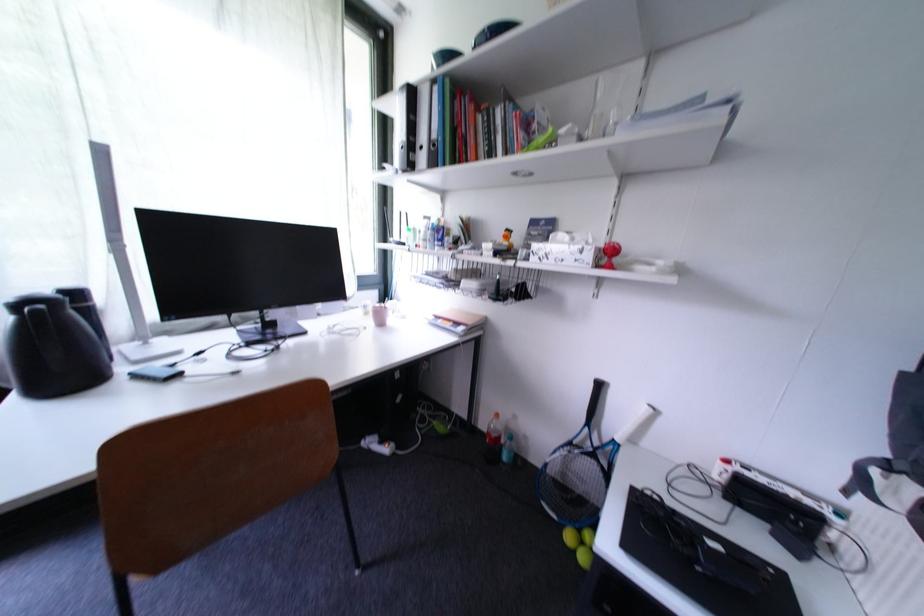
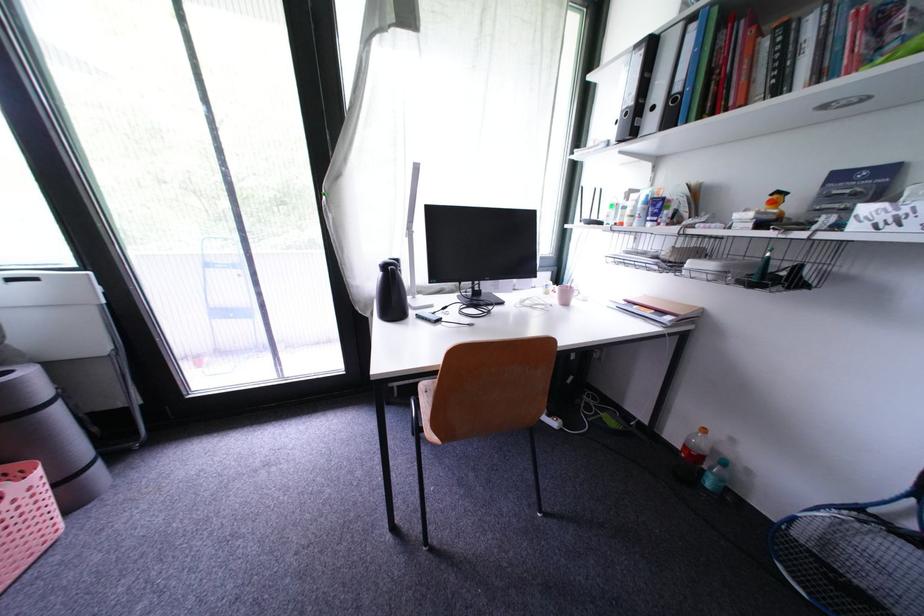
Find the pixel in the second image that matches point 398,315 in the first image.

(584, 296)